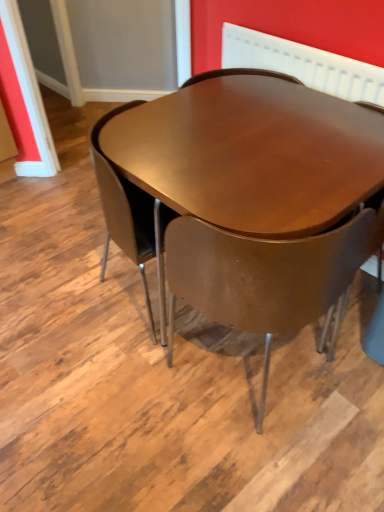
Where is `vacant area that lies in front of matte brown chair at center`? The height and width of the screenshot is (512, 384). vacant area that lies in front of matte brown chair at center is located at coordinates (269, 457).